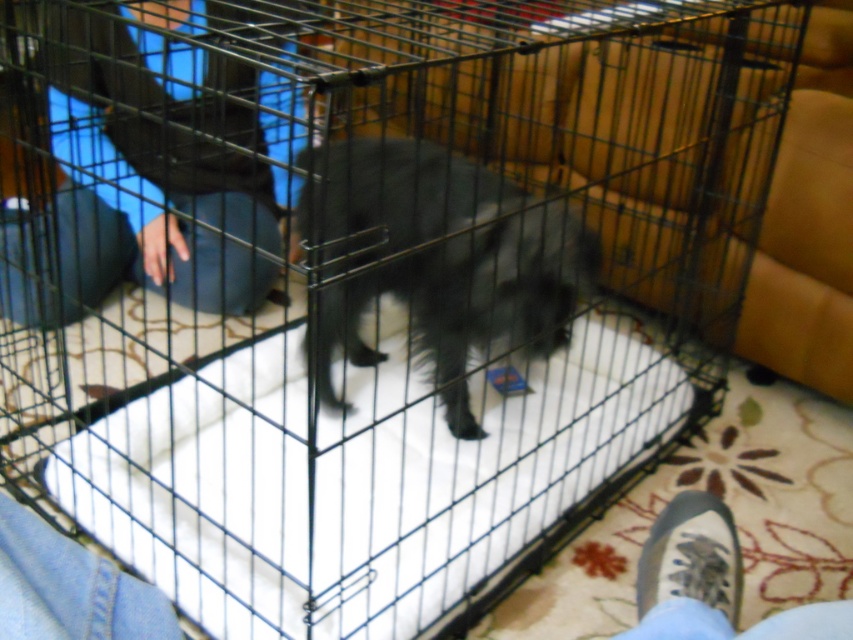
Which of these two, blue jeans at left or gray fabric shoe at lower right, stands taller?

With more height is blue jeans at left.

Is point (44, 29) closer to camera compared to point (787, 620)?

No, it is behind (787, 620).

At what (x,y) coordinates should I click in order to perform the action: click on blue jeans at left. Please return your answer as a coordinate pair (x, y). This screenshot has width=853, height=640. Looking at the image, I should click on (143, 150).

I want to click on blue jeans at left, so click(x=143, y=150).

Is point (136, 100) behind point (424, 180)?

Yes, it is behind point (424, 180).

Identify the location of blue jeans at left. (143, 150).

Measure the distance between point (469,170) and camera.

Point (469,170) and camera are 4.93 feet apart.

In the scene shown: Who is higher up, black fuzzy dog at center or gray fabric shoe at lower right?

Positioned higher is black fuzzy dog at center.

Who is more distant from viewer, (380, 234) or (701, 609)?

Positioned behind is point (380, 234).

At what (x,y) coordinates should I click in order to perform the action: click on black fuzzy dog at center. Please return your answer as a coordinate pair (x, y). Image resolution: width=853 pixels, height=640 pixels. Looking at the image, I should click on (437, 259).